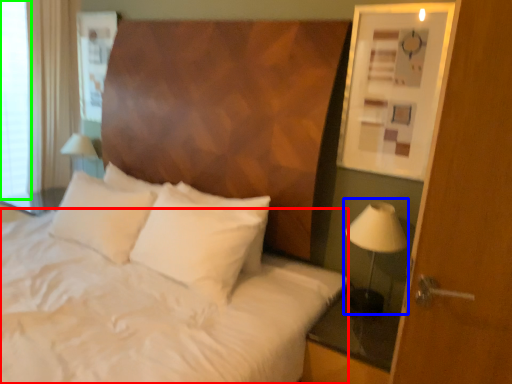
Question: Which object is positioned farthest from sheet (highlighted by a red box)? Select from bedside lamp (highlighted by a blue box) and window screen (highlighted by a green box).

Choices:
 (A) bedside lamp
 (B) window screen

Answer: (B)